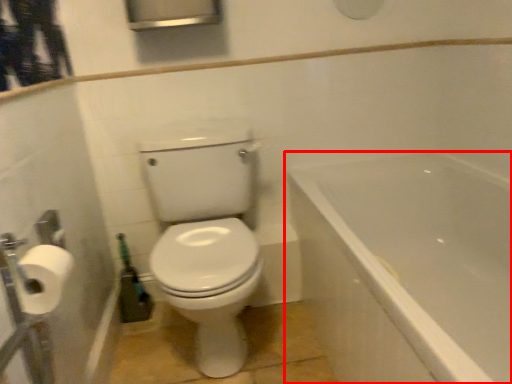
Question: From the image's perspective, considering the relative positions of bathtub (annotated by the red box) and toilet paper in the image provided, where is bathtub (annotated by the red box) located with respect to the staircase?

Choices:
 (A) above
 (B) below

Answer: (B)